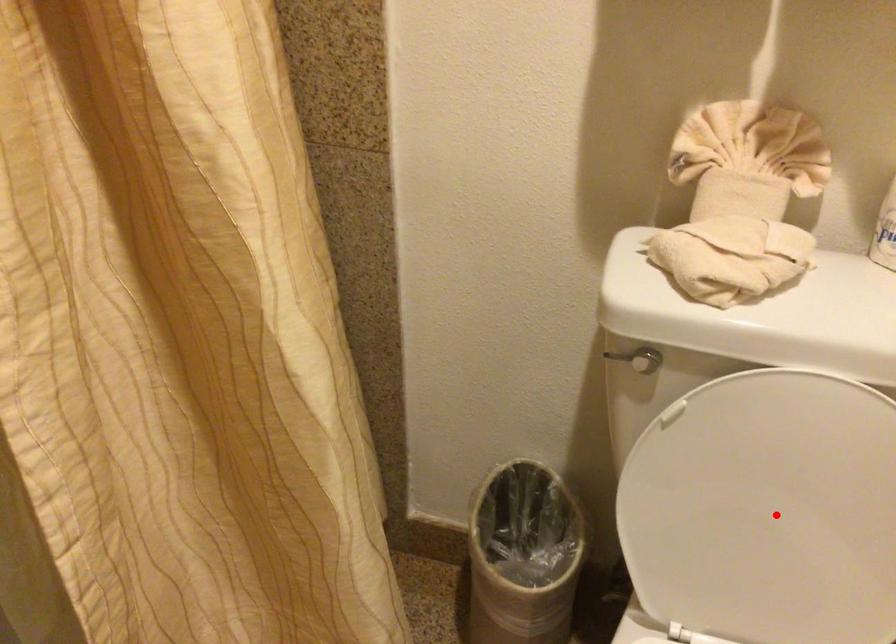
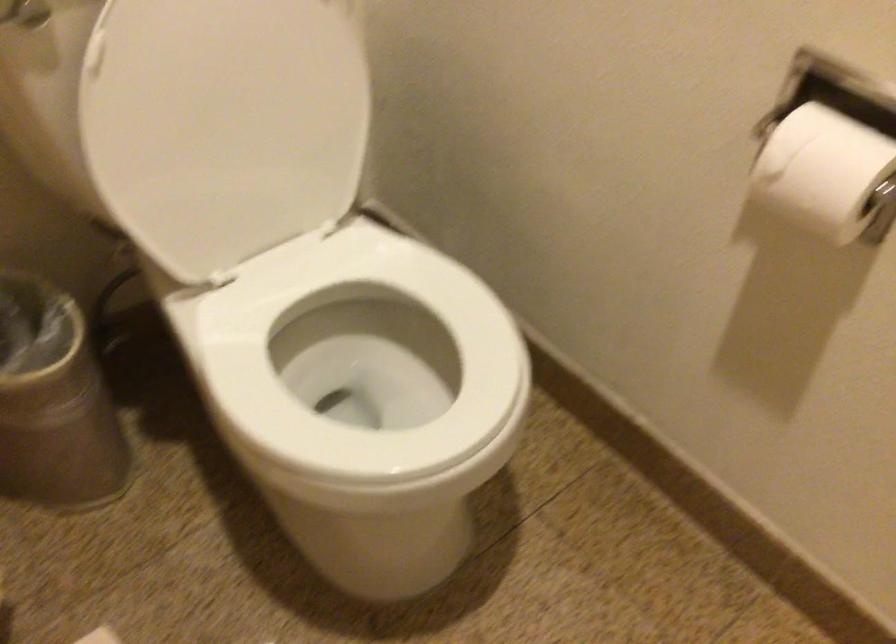
In the second image, find the point that corresponds to the highlighted location in the first image.

(239, 114)